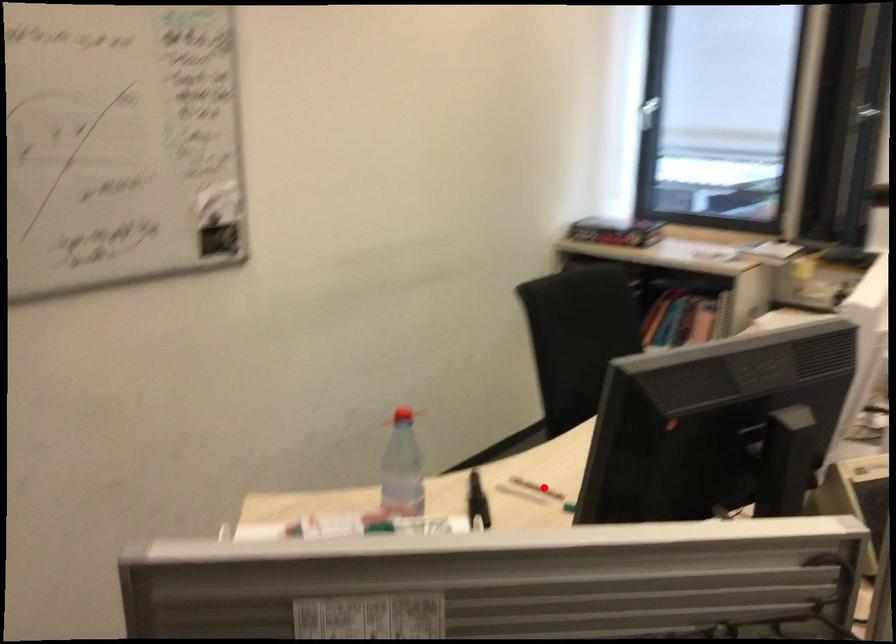
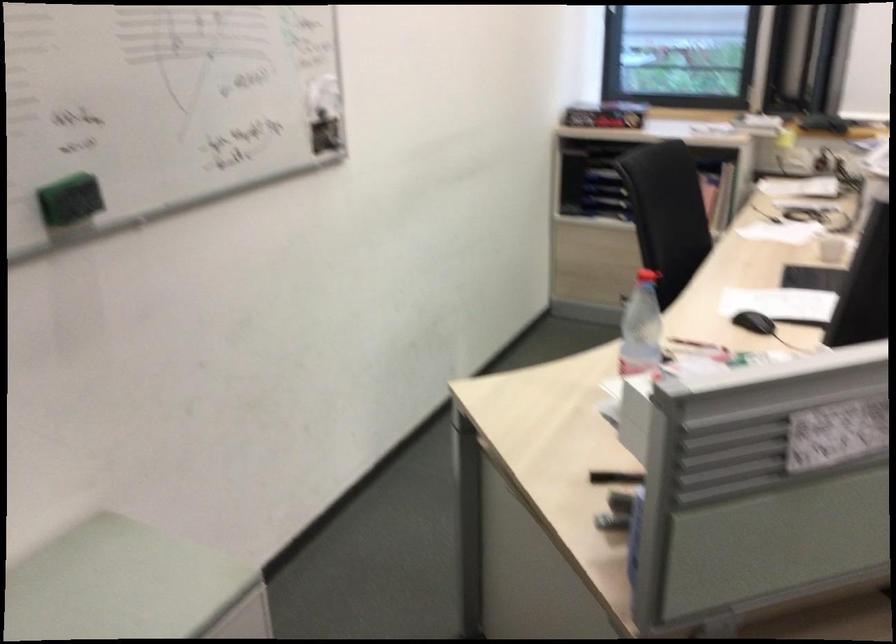
The point at the highlighted location is marked in the first image. Where is the corresponding point in the second image?

(695, 345)